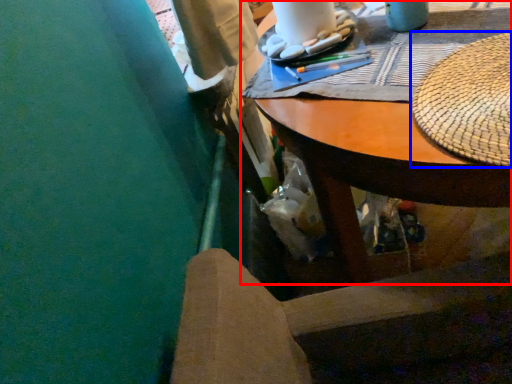
Question: Which of the following is the closest to the observer, desk (highlighted by a red box) or hat (highlighted by a blue box)?

Choices:
 (A) desk
 (B) hat

Answer: (A)